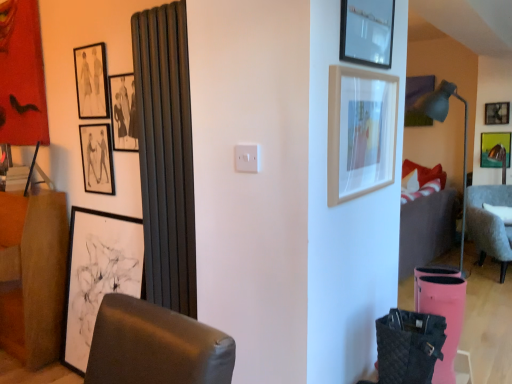
Question: Is matte black picture frame at upper left, which ranks as the fifth picture frame in front-to-back order, in front of or behind matte black picture frame at upper center, the sixth picture frame when ordered from left to right, in the image?

Choices:
 (A) front
 (B) behind

Answer: (B)

Question: In the image, is matte black picture frame at upper left, which is counted as the 4th picture frame, starting from the back, on the left side or the right side of matte black picture frame at upper center, the 7th picture frame viewed from the back?

Choices:
 (A) left
 (B) right

Answer: (A)

Question: Which of these objects is positioned farthest from the gray fabric chair at right?

Choices:
 (A) matte black picture frame at upper left, which ranks as the third picture frame in back-to-front order
 (B) white matte picture frame at left, marked as the 6th picture frame in a back-to-front arrangement
 (C) matte black picture frame at upper left, which ranks as the fifth picture frame in front-to-back order
 (D) brown fabric dresser at left
 (E) metallic silver picture frame at upper right, the seventh picture frame viewed from the left

Answer: (D)

Question: Which is nearer to the matte black picture frame at upper left, which ranks as the 6th picture frame in front-to-back order?

Choices:
 (A) light wood picture frame at upper right, acting as the first picture frame starting from the front
 (B) white matte picture frame at left, which appears as the 3th picture frame when viewed from the front
 (C) matte gray floor lamp at right
 (D) matte black picture frame at upper center, which is the 3th picture frame from right to left
 (E) matte black picture frame at upper left, the fifth picture frame in the back-to-front sequence

Answer: (E)